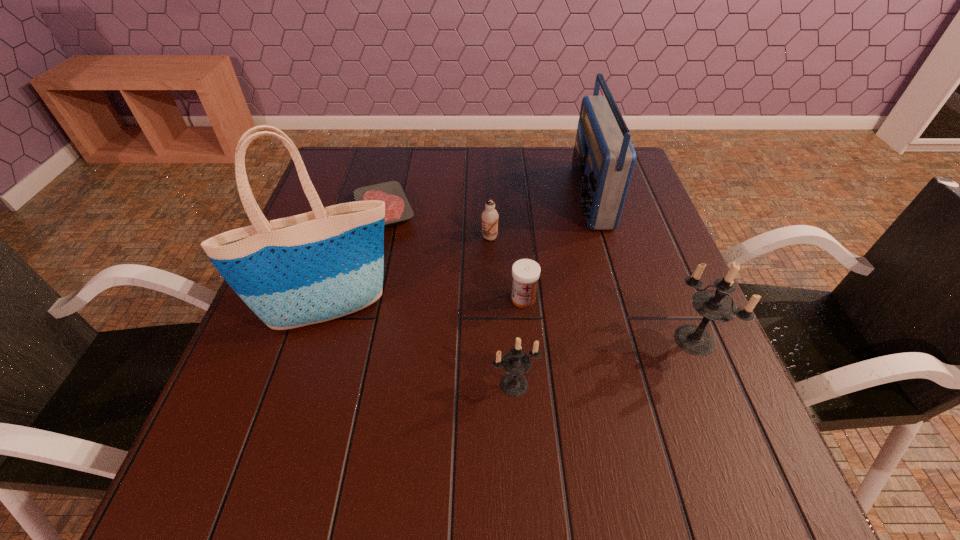
Locate an element on the screen. The image size is (960, 540). unoccupied area between the radio receiver and the right candle holder is located at coordinates (642, 268).

Locate an element on the screen. object identified as the second closest to the radio receiver is located at coordinates (525, 272).

Where is `the second closest object relative to the second tallest object`? The width and height of the screenshot is (960, 540). the second closest object relative to the second tallest object is located at coordinates (525, 272).

I want to click on free location that satisfies the following two spatial constraints: 1. on the front panel of the right candle holder; 2. on the right side of the radio receiver, so click(631, 340).

The height and width of the screenshot is (540, 960). What are the coordinates of `free space that satisfies the following two spatial constraints: 1. on the front side of the chocolate milk; 2. on the right side of the farther candle holder` in the screenshot? It's located at (492, 340).

This screenshot has width=960, height=540. Find the location of `free spot that satisfies the following two spatial constraints: 1. on the back side of the tote bag; 2. on the left side of the steak`. free spot that satisfies the following two spatial constraints: 1. on the back side of the tote bag; 2. on the left side of the steak is located at coordinates (362, 210).

In order to click on vacant region that satisfies the following two spatial constraints: 1. on the front side of the chocolate milk; 2. on the left side of the steak in this screenshot , I will do `click(377, 238)`.